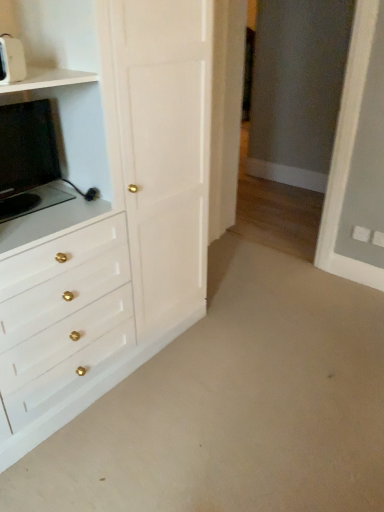
Question: Is white plastic toaster at upper left, placed as the first appliance when sorted from front to back, to the left or to the right of white glossy chest of drawers at left in the image?

Choices:
 (A) left
 (B) right

Answer: (A)

Question: Is white plastic toaster at upper left, the second appliance when ordered from back to front, in front of or behind white glossy chest of drawers at left in the image?

Choices:
 (A) front
 (B) behind

Answer: (B)

Question: Which of these objects is positioned closest to the matte black tv at left, marked as the second appliance in a front-to-back arrangement?

Choices:
 (A) white plastic toaster at upper left, placed as the first appliance when sorted from front to back
 (B) white glossy chest of drawers at left

Answer: (B)

Question: Estimate the real-world distances between objects in this image. Which object is farther from the white plastic toaster at upper left, the second appliance when ordered from back to front?

Choices:
 (A) matte black tv at left, marked as the 1th appliance in a back-to-front arrangement
 (B) white glossy chest of drawers at left

Answer: (B)